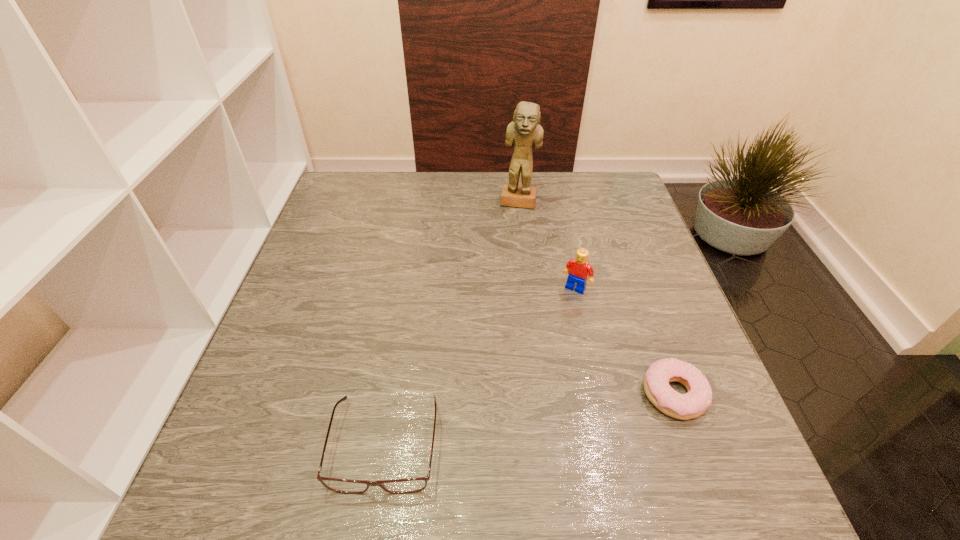
The height and width of the screenshot is (540, 960). I want to click on spectacles, so click(x=408, y=485).

I want to click on doughnut, so click(x=694, y=403).

The image size is (960, 540). I want to click on the third nearest object, so click(x=578, y=269).

Find the location of a particular element. the second tallest object is located at coordinates (578, 269).

You are a GUI agent. You are given a task and a screenshot of the screen. Output one action in this format:
    pyautogui.click(x=<x>, y=<y>)
    Task: Click on the second object from left to right
    This screenshot has height=540, width=960.
    Given the screenshot: What is the action you would take?
    pyautogui.click(x=525, y=131)

Where is `the tallest object`? This screenshot has width=960, height=540. the tallest object is located at coordinates (525, 131).

What are the coordinates of `vacant space positioned 0.210m on the left of the doughnut` in the screenshot? It's located at (533, 394).

You are a GUI agent. You are given a task and a screenshot of the screen. Output one action in this format:
    pyautogui.click(x=<x>, y=<y>)
    Task: Click on the vacant space located 0.130m on the front-facing side of the Lego
    The width and height of the screenshot is (960, 540).
    Given the screenshot: What is the action you would take?
    pyautogui.click(x=547, y=333)

Where is `free space located 0.120m on the front-facing side of the Lego`? This screenshot has width=960, height=540. free space located 0.120m on the front-facing side of the Lego is located at coordinates (549, 329).

At what (x,y) coordinates should I click in order to perform the action: click on vacant area located 0.090m on the front-facing side of the Lego. Please return your answer as a coordinate pair (x, y). The width and height of the screenshot is (960, 540). Looking at the image, I should click on (554, 320).